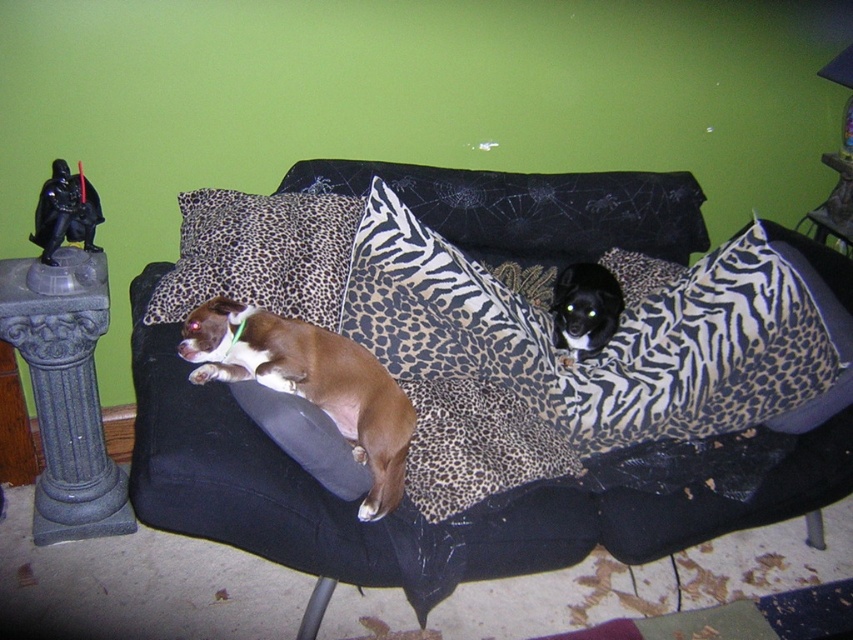
Can you confirm if leopard print fabric couch at center is positioned above black fur dog at center?

No, leopard print fabric couch at center is not above black fur dog at center.

In the scene shown: Does leopard print fabric couch at center lie behind black fur dog at center?

No, leopard print fabric couch at center is closer to the viewer.

Describe the element at coordinates (508, 396) in the screenshot. I see `leopard print fabric couch at center` at that location.

Where is `leopard print fabric couch at center`? The width and height of the screenshot is (853, 640). leopard print fabric couch at center is located at coordinates (508, 396).

Is leopard print fabric couch at center below leopard print fabric pillow at center?

Correct, leopard print fabric couch at center is located below leopard print fabric pillow at center.

Which of these two, leopard print fabric couch at center or leopard print fabric pillow at center, stands taller?

leopard print fabric couch at center is taller.

Does point (405, 276) come farther from viewer compared to point (279, 257)?

No, (405, 276) is in front of (279, 257).

Locate an element on the screen. leopard print fabric couch at center is located at coordinates (508, 396).

Which is more to the left, leopard print fabric pillow at center or brown furry dog at center?

leopard print fabric pillow at center is more to the left.

Does leopard print fabric pillow at center appear on the left side of brown furry dog at center?

Yes, leopard print fabric pillow at center is to the left of brown furry dog at center.

Which is in front, point (242, 237) or point (334, 390)?

Point (334, 390) is in front.

Find the location of `leopard print fabric pillow at center`. leopard print fabric pillow at center is located at coordinates (260, 253).